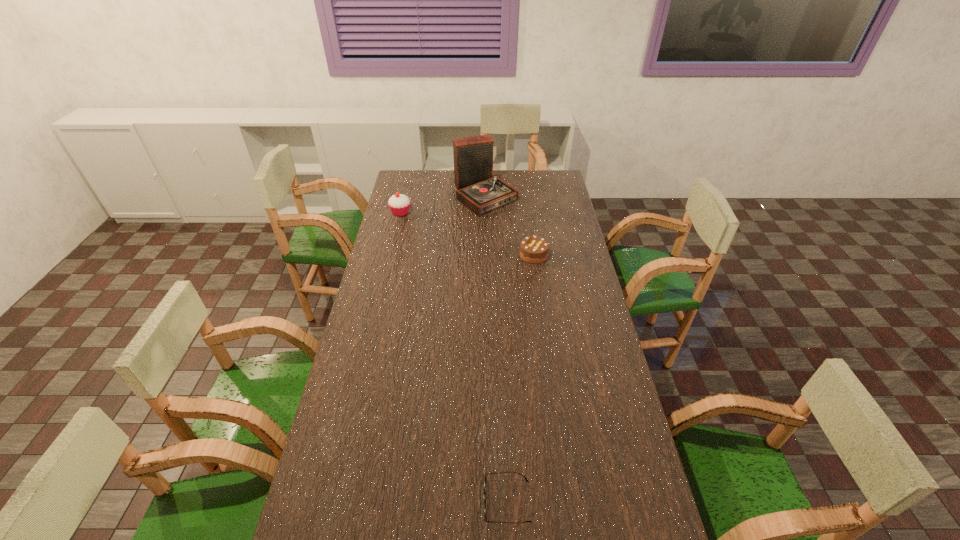
The width and height of the screenshot is (960, 540). I want to click on free area in between the second nearest object and the second tallest object, so click(x=468, y=234).

What are the coordinates of `free spot between the nearest object and the leftmost object` in the screenshot? It's located at (454, 357).

Identify the location of free space between the spectacles and the third tallest object. The height and width of the screenshot is (540, 960). (520, 378).

Identify the location of vacant space that's between the phonograph record and the shortest object. The height and width of the screenshot is (540, 960). (496, 348).

What are the coordinates of `free space that is in between the chocolate cake and the nearest object` in the screenshot? It's located at tap(520, 378).

Where is `unoccupied position between the cupcake and the nearest object`? The image size is (960, 540). unoccupied position between the cupcake and the nearest object is located at coordinates (454, 357).

Locate an element on the screen. The width and height of the screenshot is (960, 540). free space between the second nearest object and the tallest object is located at coordinates (510, 225).

Locate an element on the screen. This screenshot has height=540, width=960. free space that is in between the third tallest object and the nearest object is located at coordinates (520, 378).

Locate an element on the screen. Image resolution: width=960 pixels, height=540 pixels. blank region between the cupcake and the shortest object is located at coordinates (454, 357).

Choose which object is the second nearest neighbor to the second shortest object. Please provide its 2D coordinates. Your answer should be formatted as a tuple, i.e. [(x, y)], where the tuple contains the x and y coordinates of a point satisfying the conditions above.

[(399, 204)]